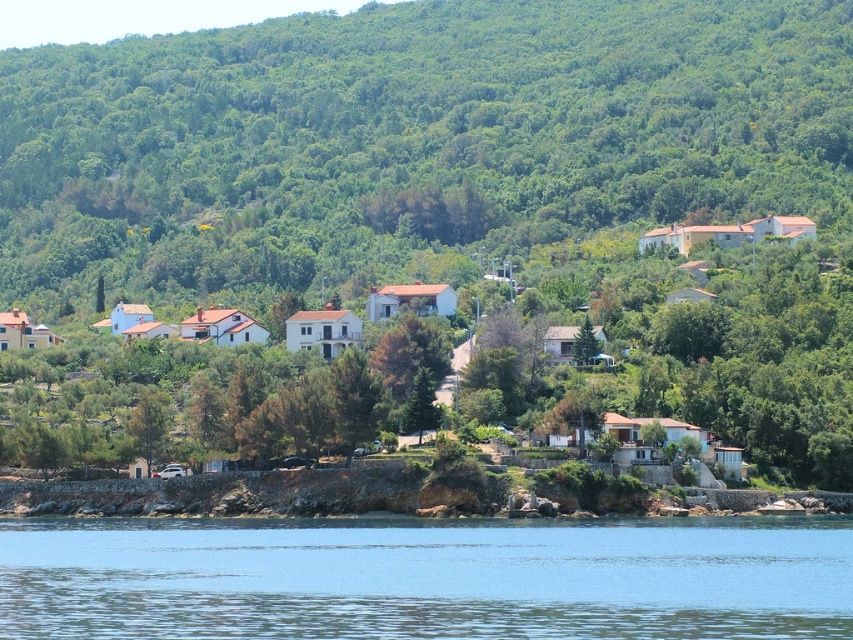
You are standing at the center of the village and notice a point marked on the image. According to the coordinates provided, what object is located at point (407, 140)?

The point (407, 140) indicates a green leafy tree at center.

Looking at this image, you are standing at point (151, 49) in the coastal village scene. A friend is at another location 541.97 meters away from you. Based on the scene description, what is the furthest point your friend could be from the cluster of white houses with terracotta red roofs?

The friend could be up to 541.97 meters away from the cluster of white houses with terracotta red roofs, as they are located 541.97 meters apart from each other.

You are standing at the center of the village and want to locate the green leafy tree at center. According to the coordinates provided, where would you find it?

The green leafy tree at center is located at coordinates point (407,140).